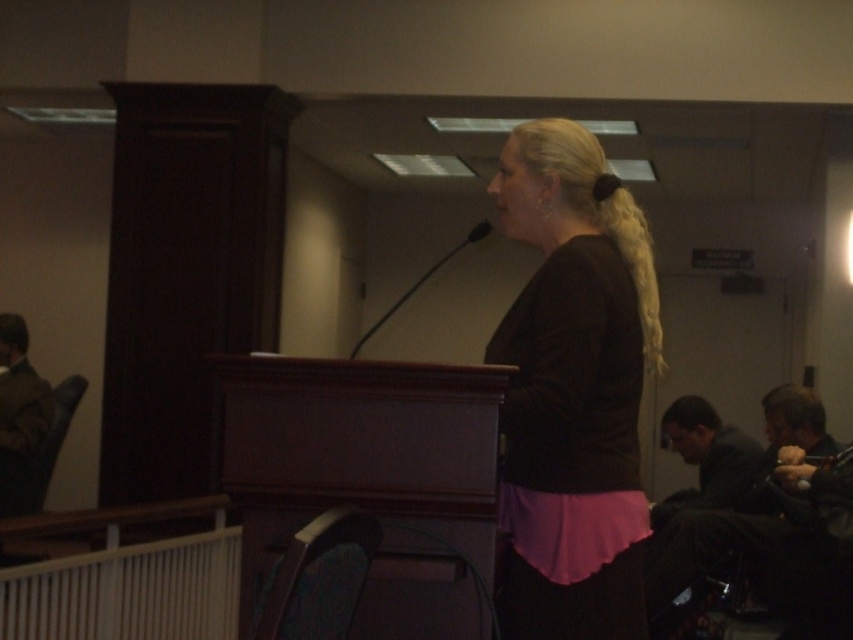
Question: Is matte brown blouse at center bigger than black matte microphone at center?

Choices:
 (A) no
 (B) yes

Answer: (A)

Question: Which point is farther to the camera?

Choices:
 (A) matte brown blouse at center
 (B) black matte microphone at center

Answer: (B)

Question: Which of the following is the farthest from the observer?

Choices:
 (A) black matte microphone at center
 (B) matte brown blouse at center

Answer: (A)

Question: Is matte brown blouse at center above black matte microphone at center?

Choices:
 (A) yes
 (B) no

Answer: (B)

Question: Does matte brown blouse at center appear on the left side of black matte microphone at center?

Choices:
 (A) yes
 (B) no

Answer: (B)